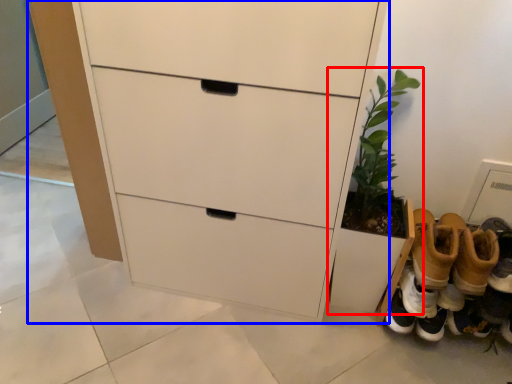
Question: Which point is further to the camera, houseplant (highlighted by a red box) or chest of drawers (highlighted by a blue box)?

Choices:
 (A) houseplant
 (B) chest of drawers

Answer: (A)